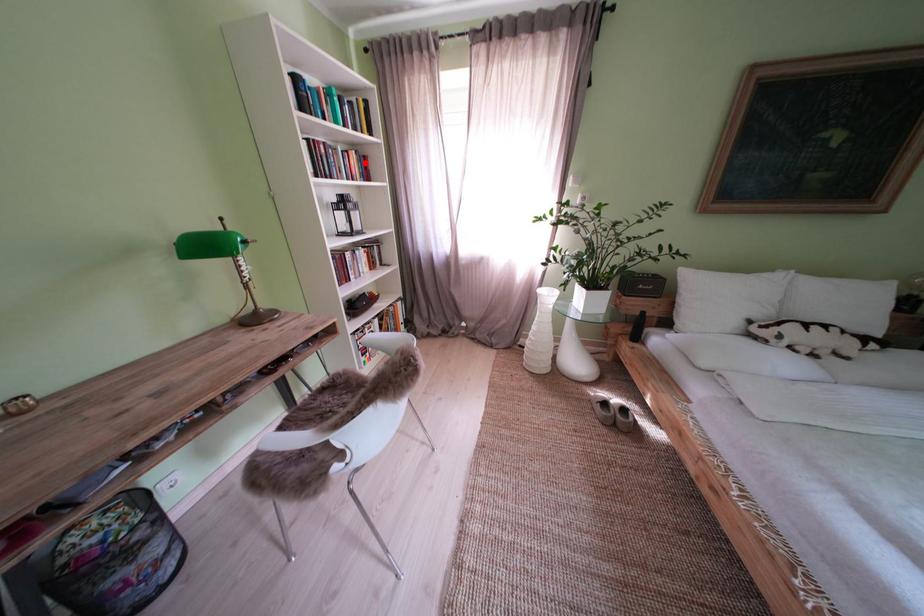
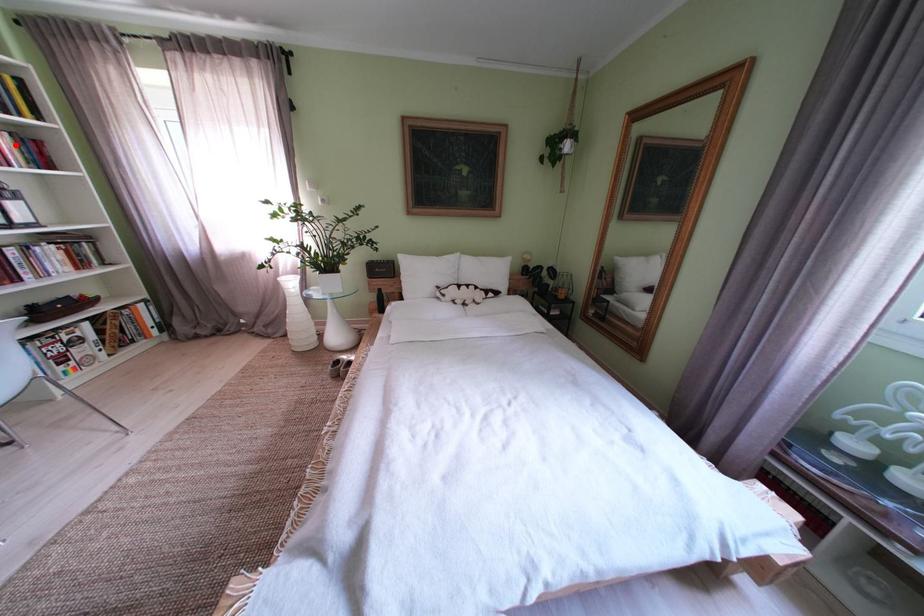
I am providing you with two images of the same scene from different viewpoints. A red point is marked on the first image and another point is marked on the second image. Does the point marked in image1 correspond to the same location as the one in image2?

Yes